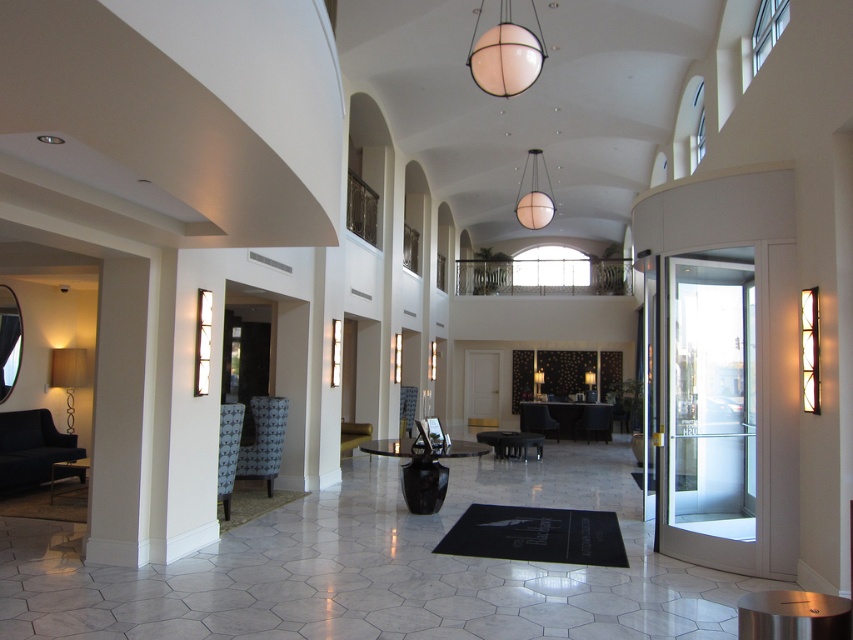
You are standing at point (409, 416) and want to walk to the entrance located at point (602, 426). Is there a clear path between these two points?

Point (602, 426) is behind point (409, 416), so there is a clear path between them.

In the scene shown: You are a guest in this hotel and want to sit in the patterned fabric armchair at left. To do so, you need to walk around the matte gold lamp at left. Is the lamp in your way?

The patterned fabric armchair at left is positioned under the matte gold lamp at left, so the lamp is directly above the chair. Since the lamp is above the chair, it won not block your path, so you can sit in the patterned fabric armchair at left without needing to move the lamp.

You are standing in the lobby of a modern hotel and need to place a 4 meter long decorative banner between the patterned fabric armchair at left and the matte gold lamp at left. Will the banner fit between them?

The distance between the patterned fabric armchair at left and the matte gold lamp at left is 3.88 meters. Since the banner is 4 meters long, it will be slightly too long to fit between them without overlapping or bending.